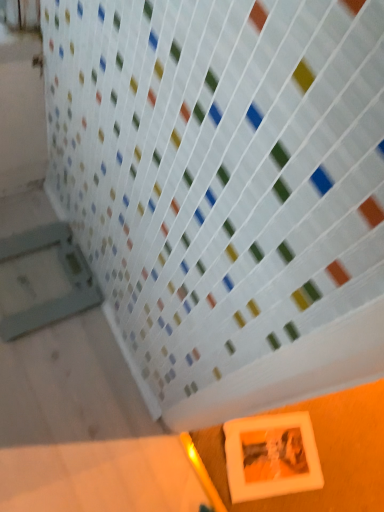
Find the location of a particular element. Image resolution: width=384 pixels, height=512 pixels. empty space that is to the right of white matte picture frame at lower right is located at coordinates (336, 467).